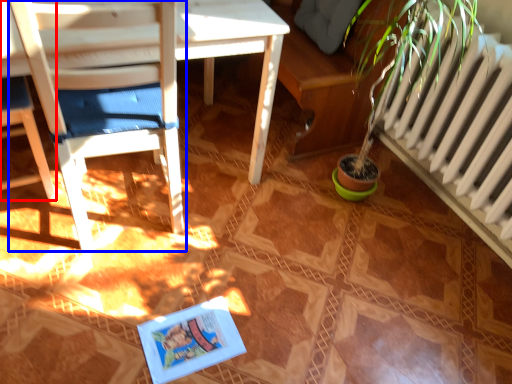
Question: Which object appears closest to the camera in this image, chair (highlighted by a red box) or chair (highlighted by a blue box)?

Choices:
 (A) chair
 (B) chair

Answer: (B)